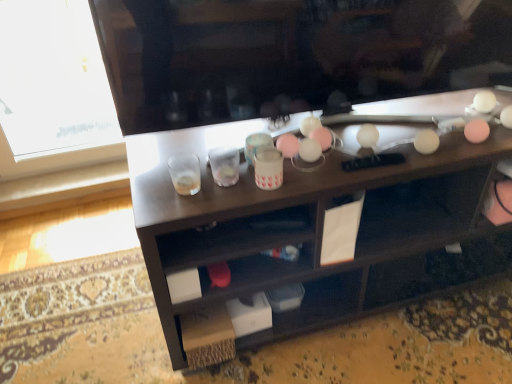
Where is `clear plastic shot glass at center, which is counted as the 2th shot glass, starting from the left`? Image resolution: width=512 pixels, height=384 pixels. clear plastic shot glass at center, which is counted as the 2th shot glass, starting from the left is located at coordinates (224, 165).

You are a GUI agent. You are given a task and a screenshot of the screen. Output one action in this format:
    pyautogui.click(x=<x>, y=<y>)
    Task: Click on the translucent glass at center, which ranks as the second shot glass in right-to-left order
    This screenshot has width=512, height=384.
    Given the screenshot: What is the action you would take?
    pyautogui.click(x=185, y=173)

Find the location of a particular element. The image size is (512, 384). pink matte cup at center is located at coordinates (268, 168).

Find the location of a particular element. clear plastic shot glass at center, which is counted as the 2th shot glass, starting from the left is located at coordinates [x=224, y=165].

Image resolution: width=512 pixels, height=384 pixels. I want to click on desk below the translucent glass at center, which ranks as the second shot glass in right-to-left order (from a real-world perspective), so click(x=304, y=226).

Considering the points (362, 239) and (185, 191), which point is in front, point (362, 239) or point (185, 191)?

Point (185, 191)

Based on their positions, is wooden desk at center located to the left or right of translucent glass at center, placed as the first shot glass when sorted from left to right?

In the image, wooden desk at center appears on the right side of translucent glass at center, placed as the first shot glass when sorted from left to right.

Is wooden desk at center inside or outside of translucent glass at center, placed as the first shot glass when sorted from left to right?

wooden desk at center is not inside translucent glass at center, placed as the first shot glass when sorted from left to right, it's outside.

Which is closer, (257, 171) or (230, 184)?

Point (257, 171) is positioned closer to the camera compared to point (230, 184).

How different are the orientations of pink matte cup at center and clear plastic shot glass at center, the 1th shot glass from the right, in degrees?

The angular difference between pink matte cup at center and clear plastic shot glass at center, the 1th shot glass from the right, is 0.000931 degrees.

From a real-world perspective, is pink matte cup at center positioned above or below clear plastic shot glass at center, the 1th shot glass from the right?

Clearly, from a real-world perspective, pink matte cup at center is below clear plastic shot glass at center, the 1th shot glass from the right.

Is pink matte cup at center located outside clear plastic shot glass at center, the 1th shot glass from the right?

Yes, pink matte cup at center is outside of clear plastic shot glass at center, the 1th shot glass from the right.

Is translucent glass at center, which ranks as the second shot glass in right-to-left order, directly adjacent to wooden desk at center?

No, translucent glass at center, which ranks as the second shot glass in right-to-left order, is not next to wooden desk at center.

Measure the distance between translucent glass at center, which ranks as the second shot glass in right-to-left order, and wooden desk at center.

16.11 inches.

Is point (184, 170) positioned in front of point (283, 193)?

No, it is not.

From a real-world perspective, is wooden desk at center below clear plastic shot glass at center, the 1th shot glass from the right?

Yes.

Which is behind, point (385, 298) or point (216, 168)?

The point (385, 298) is behind.

Considering the relative positions of wooden desk at center and clear plastic shot glass at center, the 1th shot glass from the right, in the image provided, is wooden desk at center in front of clear plastic shot glass at center, the 1th shot glass from the right,?

Yes, wooden desk at center is closer to the camera.

Is translucent glass at center, placed as the first shot glass when sorted from left to right, situated inside clear plastic shot glass at center, the 1th shot glass from the right, or outside?

translucent glass at center, placed as the first shot glass when sorted from left to right, exists outside the volume of clear plastic shot glass at center, the 1th shot glass from the right.

Can you tell me how much translucent glass at center, placed as the first shot glass when sorted from left to right, and clear plastic shot glass at center, which is counted as the 2th shot glass, starting from the left, differ in facing direction?

The angular difference between translucent glass at center, placed as the first shot glass when sorted from left to right, and clear plastic shot glass at center, which is counted as the 2th shot glass, starting from the left, is 0.00608 degrees.

From a real-world perspective, which is physically below, translucent glass at center, which ranks as the second shot glass in right-to-left order, or clear plastic shot glass at center, the 1th shot glass from the right?

translucent glass at center, which ranks as the second shot glass in right-to-left order, from a real-world perspective.

Find the location of `shot glass behind the translucent glass at center, placed as the first shot glass when sorted from left to right`. shot glass behind the translucent glass at center, placed as the first shot glass when sorted from left to right is located at coordinates (224, 165).

Considering the sizes of objects pink matte cup at center and wooden desk at center in the image provided, who is bigger, pink matte cup at center or wooden desk at center?

wooden desk at center.

Considering the relative sizes of pink matte cup at center and wooden desk at center in the image provided, is pink matte cup at center wider than wooden desk at center?

In fact, pink matte cup at center might be narrower than wooden desk at center.

From a real-world perspective, is pink matte cup at center on top of wooden desk at center?

Yes, from a real-world perspective, pink matte cup at center is above wooden desk at center.

From a real-world perspective, is translucent glass at center, which ranks as the second shot glass in right-to-left order, above or below pink matte cup at center?

Clearly, from a real-world perspective, translucent glass at center, which ranks as the second shot glass in right-to-left order, is below pink matte cup at center.

Would you say translucent glass at center, which ranks as the second shot glass in right-to-left order, is outside pink matte cup at center?

translucent glass at center, which ranks as the second shot glass in right-to-left order, lies outside pink matte cup at center's area.

Between translucent glass at center, which ranks as the second shot glass in right-to-left order, and pink matte cup at center, which one appears on the right side from the viewer's perspective?

Positioned to the right is pink matte cup at center.

Considering the points (169, 160) and (272, 180), which point is in front, point (169, 160) or point (272, 180)?

The point (272, 180) is more forward.

Image resolution: width=512 pixels, height=384 pixels. What are the coordinates of `the 1st shot glass behind the wooden desk at center` in the screenshot? It's located at (185, 173).

Image resolution: width=512 pixels, height=384 pixels. In order to click on beverage that appears on the right of clear plastic shot glass at center, which is counted as the 2th shot glass, starting from the left in this screenshot , I will do `click(268, 168)`.

Considering their positions, is pink matte cup at center positioned closer to clear plastic shot glass at center, the 1th shot glass from the right, than wooden desk at center?

pink matte cup at center is closer to clear plastic shot glass at center, the 1th shot glass from the right.

Estimate the real-world distances between objects in this image. Which object is further from clear plastic shot glass at center, the 1th shot glass from the right, wooden desk at center or pink matte cup at center?

Based on the image, wooden desk at center appears to be further to clear plastic shot glass at center, the 1th shot glass from the right.

Looking at the image, which one is located closer to wooden desk at center, translucent glass at center, which ranks as the second shot glass in right-to-left order, or clear plastic shot glass at center, the 1th shot glass from the right?

The object closer to wooden desk at center is clear plastic shot glass at center, the 1th shot glass from the right.

Considering their positions, is pink matte cup at center positioned further to wooden desk at center than clear plastic shot glass at center, the 1th shot glass from the right?

clear plastic shot glass at center, the 1th shot glass from the right, is positioned further to the anchor wooden desk at center.

Which object lies further to the anchor point wooden desk at center, clear plastic shot glass at center, the 1th shot glass from the right, or translucent glass at center, placed as the first shot glass when sorted from left to right?

translucent glass at center, placed as the first shot glass when sorted from left to right, is positioned further to the anchor wooden desk at center.

Estimate the real-world distances between objects in this image. Which object is further from pink matte cup at center, translucent glass at center, which ranks as the second shot glass in right-to-left order, or clear plastic shot glass at center, the 1th shot glass from the right?

translucent glass at center, which ranks as the second shot glass in right-to-left order.

Based on their spatial positions, is pink matte cup at center or translucent glass at center, placed as the first shot glass when sorted from left to right, further from wooden desk at center?

translucent glass at center, placed as the first shot glass when sorted from left to right, lies further to wooden desk at center than the other object.

Which object lies nearer to the anchor point translucent glass at center, which ranks as the second shot glass in right-to-left order, pink matte cup at center or wooden desk at center?

pink matte cup at center lies closer to translucent glass at center, which ranks as the second shot glass in right-to-left order, than the other object.

Find the location of a particular element. This screenshot has width=512, height=384. shot glass situated between translucent glass at center, placed as the first shot glass when sorted from left to right, and pink matte cup at center from left to right is located at coordinates (224, 165).

Locate an element on the screen. This screenshot has height=384, width=512. beverage between translucent glass at center, placed as the first shot glass when sorted from left to right, and wooden desk at center is located at coordinates (268, 168).

Locate an element on the screen. The height and width of the screenshot is (384, 512). shot glass between translucent glass at center, which ranks as the second shot glass in right-to-left order, and wooden desk at center from left to right is located at coordinates (224, 165).

You are a GUI agent. You are given a task and a screenshot of the screen. Output one action in this format:
    pyautogui.click(x=<x>, y=<y>)
    Task: Click on the beverage located between clear plastic shot glass at center, which is counted as the 2th shot glass, starting from the left, and wooden desk at center in the left-right direction
    
    Given the screenshot: What is the action you would take?
    pyautogui.click(x=268, y=168)